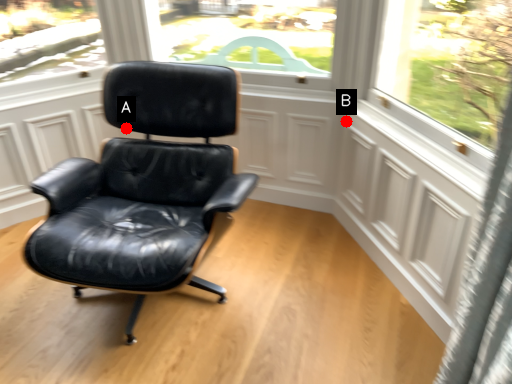
Question: Two points are circled on the image, labeled by A and B beside each circle. Which of the following is the farthest from the observer?

Choices:
 (A) A is further
 (B) B is further

Answer: (B)